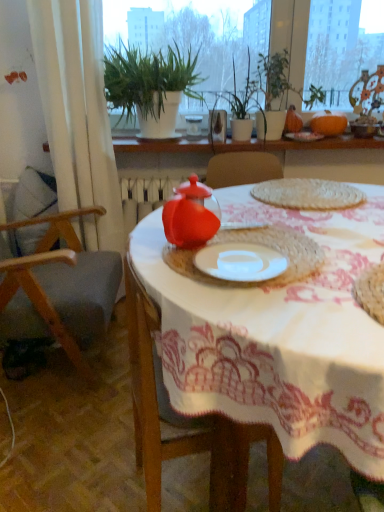
I want to click on vacant point to the right of matte plastic teapot at center, which appears as the second tableware when viewed from the back, so click(x=269, y=240).